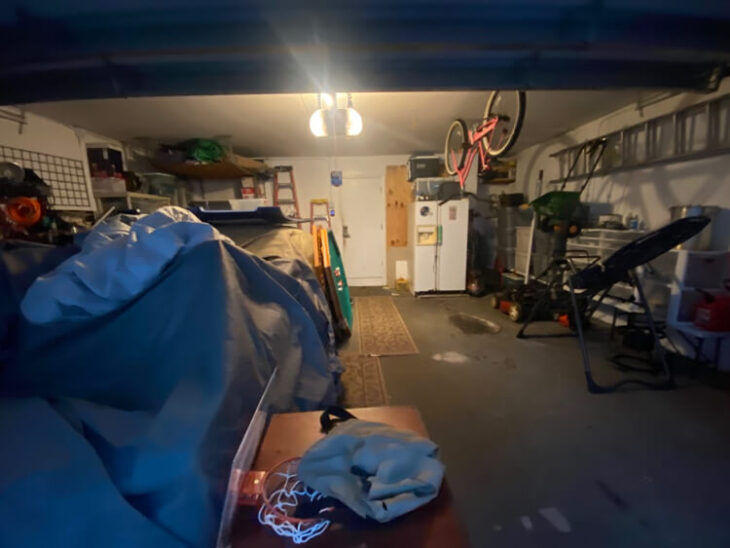
I want to click on fridge, so click(445, 247).